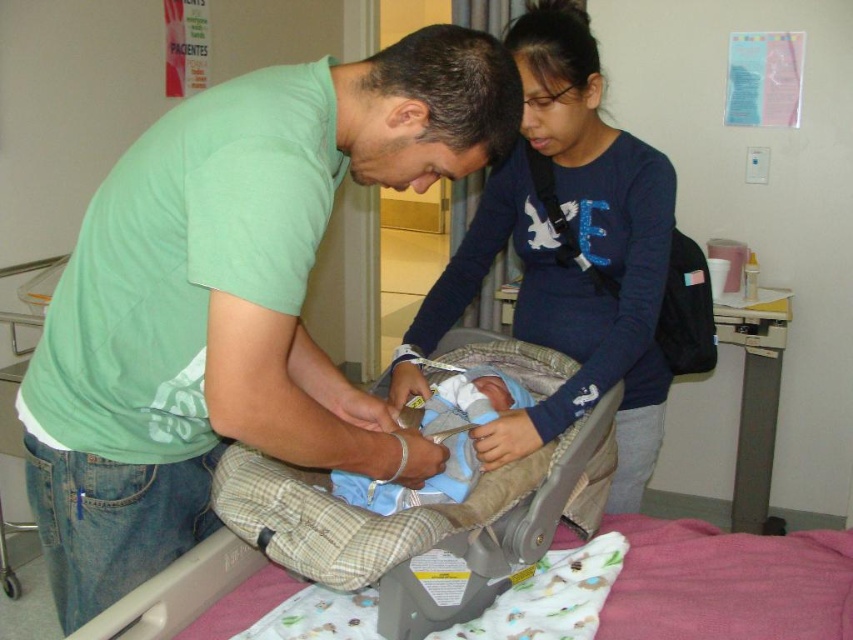
Question: Which object is farther from the camera taking this photo?

Choices:
 (A) dark blue cotton shirt at upper center
 (B) green cotton shirt at center
 (C) blue fabric newborn at center

Answer: (A)

Question: Which point is closer to the camera taking this photo?

Choices:
 (A) (608, 248)
 (B) (157, 550)
 (C) (439, 422)
 (D) (537, 454)

Answer: (B)

Question: Is green cotton shirt at center wider than dark blue cotton shirt at upper center?

Choices:
 (A) yes
 (B) no

Answer: (A)

Question: Observing the image, what is the correct spatial positioning of soft beige fabric infant bed at center in reference to blue fabric newborn at center?

Choices:
 (A) left
 (B) right

Answer: (B)

Question: Considering the real-world distances, which object is farthest from the soft beige fabric infant bed at center?

Choices:
 (A) dark blue cotton shirt at upper center
 (B) green cotton shirt at center
 (C) blue fabric newborn at center

Answer: (B)

Question: Considering the relative positions of dark blue cotton shirt at upper center and blue fabric newborn at center in the image provided, where is dark blue cotton shirt at upper center located with respect to blue fabric newborn at center?

Choices:
 (A) below
 (B) above

Answer: (B)